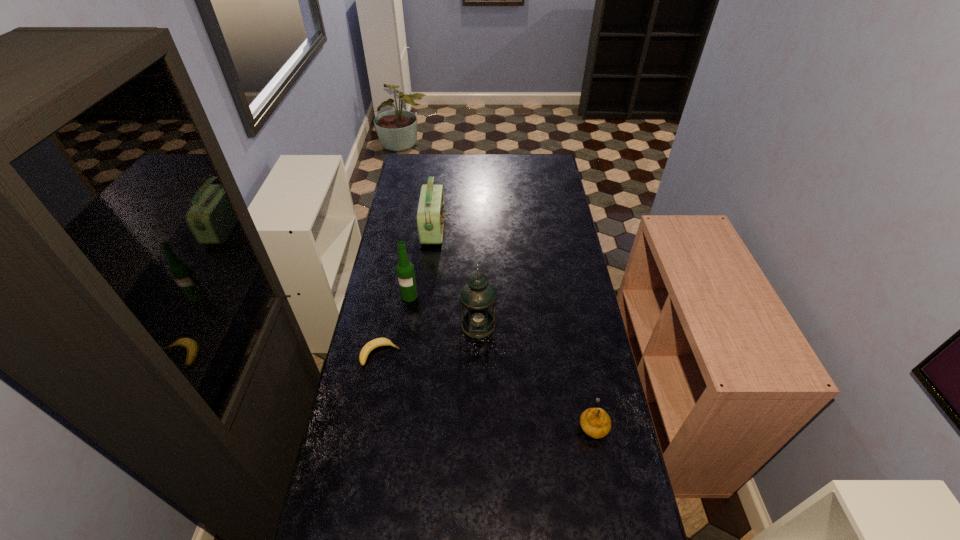
Locate an element on the screen. This screenshot has height=540, width=960. the second object from right to left is located at coordinates (478, 298).

I want to click on oil lamp, so click(478, 298).

Locate an element on the screen. The width and height of the screenshot is (960, 540). the second tallest object is located at coordinates (405, 270).

Locate an element on the screen. This screenshot has height=540, width=960. the fourth nearest object is located at coordinates (405, 270).

The height and width of the screenshot is (540, 960). Find the location of `radio receiver`. radio receiver is located at coordinates (431, 208).

At what (x,y) coordinates should I click in order to perform the action: click on the farthest object. Please return your answer as a coordinate pair (x, y). Image resolution: width=960 pixels, height=540 pixels. Looking at the image, I should click on (431, 208).

Where is `pear`? pear is located at coordinates (595, 422).

The image size is (960, 540). Find the location of `the rightmost object`. the rightmost object is located at coordinates (595, 422).

Identify the location of the shortest object. The image size is (960, 540). (378, 342).

The width and height of the screenshot is (960, 540). What are the coordinates of `the fourth farthest object` in the screenshot? It's located at (378, 342).